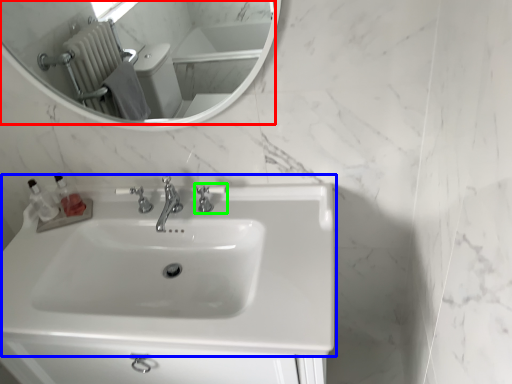
Question: Which object is positioned closest to mirror (highlighted by a red box)? Select from sink (highlighted by a blue box) and tap (highlighted by a green box).

Choices:
 (A) sink
 (B) tap

Answer: (A)